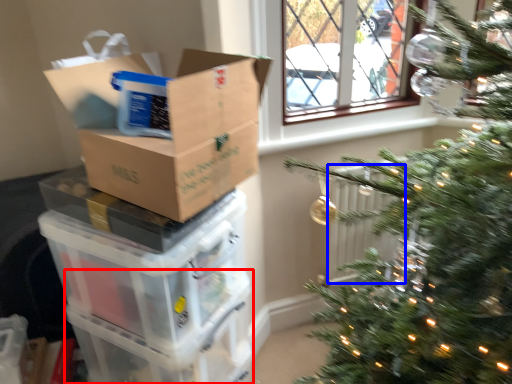
Question: Which point is closer to the camera, glass box (highlighted by a red box) or radiator (highlighted by a blue box)?

Choices:
 (A) glass box
 (B) radiator

Answer: (A)